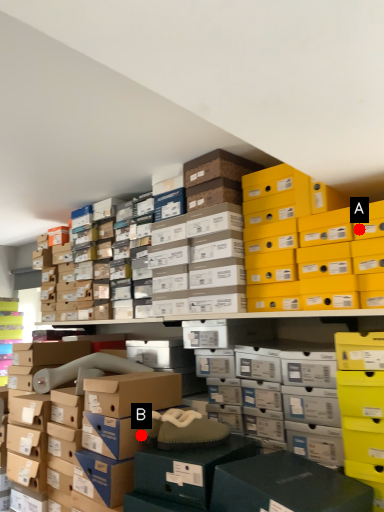
Question: Two points are circled on the image, labeled by A and B beside each circle. Which point is closer to the camera taking this photo?

Choices:
 (A) A is closer
 (B) B is closer

Answer: (A)